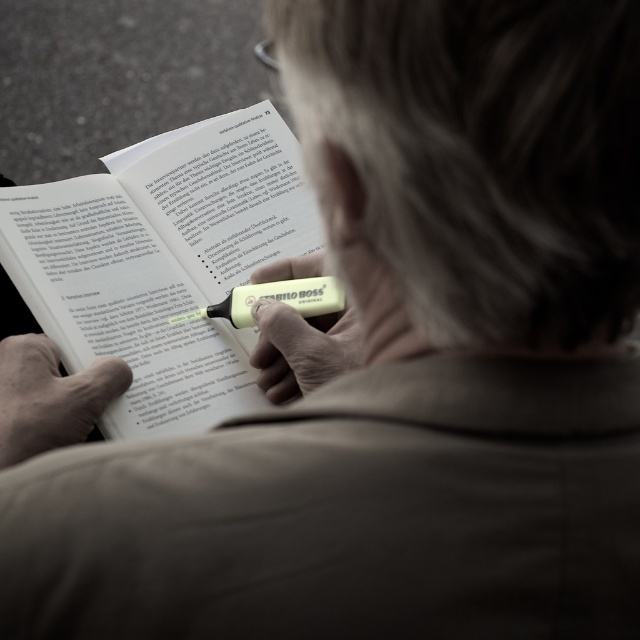
Question: Is smooth beige hand at lower left to the right of yellow matte highlighter at center from the viewer's perspective?

Choices:
 (A) no
 (B) yes

Answer: (A)

Question: Which point is closer to the camera taking this photo?

Choices:
 (A) (328, 376)
 (B) (109, 376)

Answer: (B)

Question: Is smooth beige hand at lower left wider than yellow matte highlighter at center?

Choices:
 (A) yes
 (B) no

Answer: (B)

Question: Does smooth beige hand at lower left appear on the left side of yellow matte highlighter at center?

Choices:
 (A) no
 (B) yes

Answer: (B)

Question: Which point appears closest to the camera in this image?

Choices:
 (A) (284, 394)
 (B) (296, 252)

Answer: (A)

Question: Estimate the real-world distances between objects in this image. Which object is farther from the smooth beige hand at lower left?

Choices:
 (A) yellow matte highlighter at center
 (B) yellow highlighter at center

Answer: (A)